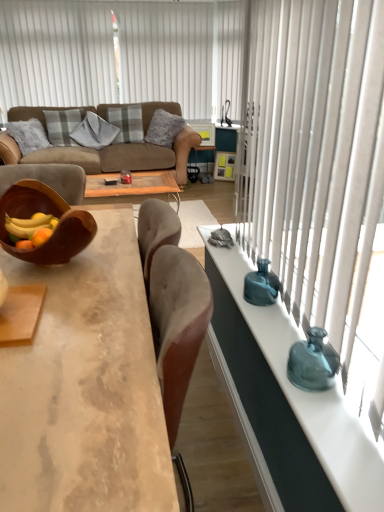
Question: Should I look upward or downward to see concrete textured coffee table at center?

Choices:
 (A) up
 (B) down

Answer: (B)

Question: Is concrete textured coffee table at center positioned in front of plaid fabric pillow at upper left, which is the 1th pillow from left to right?

Choices:
 (A) no
 (B) yes

Answer: (B)

Question: Is concrete textured coffee table at center wider than plaid fabric pillow at upper left, which is the 1th pillow from left to right?

Choices:
 (A) yes
 (B) no

Answer: (A)

Question: Is the depth of concrete textured coffee table at center greater than that of plaid fabric pillow at upper left, which is the 1th pillow from left to right?

Choices:
 (A) no
 (B) yes

Answer: (A)

Question: From the image's perspective, is concrete textured coffee table at center on top of plaid fabric pillow at upper left, which is the 1th pillow from left to right?

Choices:
 (A) yes
 (B) no

Answer: (B)

Question: Is concrete textured coffee table at center to the left of plaid fabric pillow at upper left, the fourth pillow when ordered from right to left, from the viewer's perspective?

Choices:
 (A) yes
 (B) no

Answer: (B)

Question: Does concrete textured coffee table at center have a larger size compared to plaid fabric pillow at upper left, which is the 1th pillow from left to right?

Choices:
 (A) no
 (B) yes

Answer: (B)

Question: Is white vertical blinds at upper left to the right of plaid fabric pillow at upper left, which is the 1th pillow from left to right, from the viewer's perspective?

Choices:
 (A) yes
 (B) no

Answer: (A)

Question: Is white vertical blinds at upper left looking in the opposite direction of plaid fabric pillow at upper left, the fourth pillow when ordered from right to left?

Choices:
 (A) yes
 (B) no

Answer: (B)

Question: Can you confirm if white vertical blinds at upper left is positioned to the left of plaid fabric pillow at upper left, which is the 1th pillow from left to right?

Choices:
 (A) yes
 (B) no

Answer: (B)

Question: Is white vertical blinds at upper left bigger than plaid fabric pillow at upper left, the fourth pillow when ordered from right to left?

Choices:
 (A) yes
 (B) no

Answer: (A)

Question: Is white vertical blinds at upper left positioned beyond the bounds of plaid fabric pillow at upper left, which is the 1th pillow from left to right?

Choices:
 (A) yes
 (B) no

Answer: (A)

Question: Does white vertical blinds at upper left turn towards plaid fabric pillow at upper left, the fourth pillow when ordered from right to left?

Choices:
 (A) yes
 (B) no

Answer: (A)

Question: Does plaid fabric pillow at upper left, the fourth pillow when ordered from right to left, have a lesser width compared to teal glass vase at right, placed as the 2th vase when sorted from top to bottom?

Choices:
 (A) no
 (B) yes

Answer: (A)